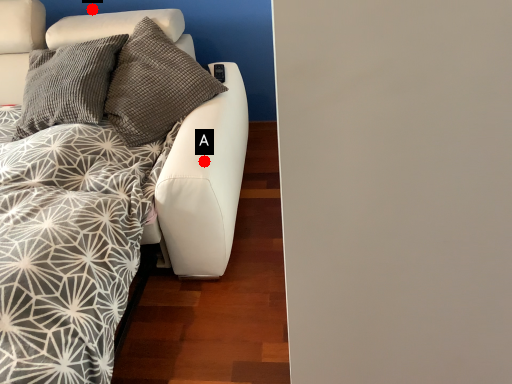
Question: Two points are circled on the image, labeled by A and B beside each circle. Which of the following is the closest to the observer?

Choices:
 (A) A is closer
 (B) B is closer

Answer: (A)